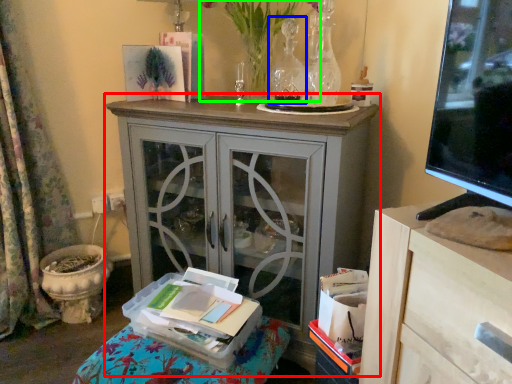
Question: Considering the real-world distances, which object is closest to cabinetry (highlighted by a red box)? vase (highlighted by a blue box) or floral arrangement (highlighted by a green box).

Choices:
 (A) vase
 (B) floral arrangement

Answer: (B)